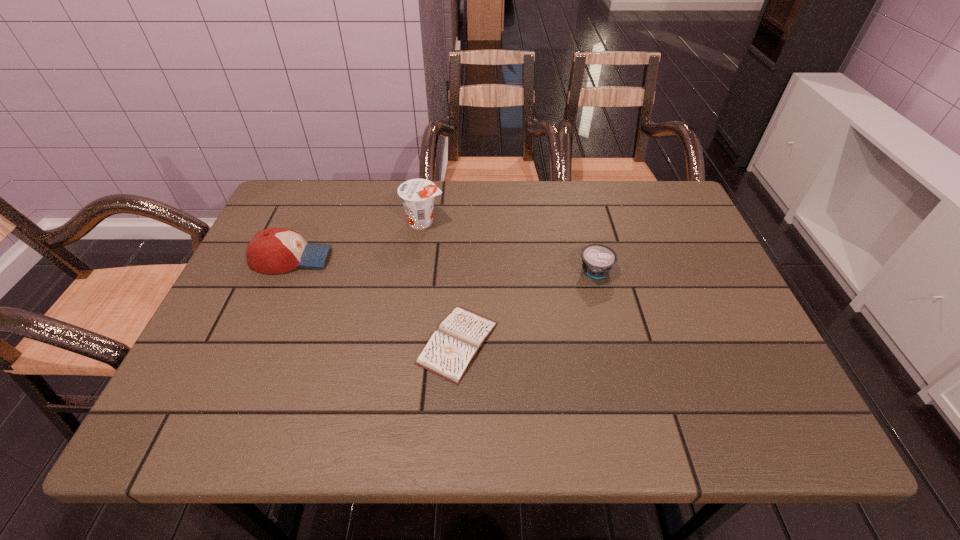
Locate which object is the third closest to the diary. Please provide its 2D coordinates. Your answer should be formatted as a tuple, i.e. [(x, y)], where the tuple contains the x and y coordinates of a point satisfying the conditions above.

[(275, 250)]

Locate an element on the screen. This screenshot has height=540, width=960. vacant space that satisfies the following two spatial constraints: 1. on the front side of the taller yogurt; 2. on the right side of the third tallest object is located at coordinates (417, 272).

Locate an element on the screen. This screenshot has width=960, height=540. free spot that satisfies the following two spatial constraints: 1. on the front-facing side of the third tallest object; 2. on the right side of the third shortest object is located at coordinates pos(286,272).

Find the location of a particular element. This screenshot has height=540, width=960. free space that satisfies the following two spatial constraints: 1. on the back side of the nearer yogurt; 2. on the front-facing side of the leftmost object is located at coordinates (592, 259).

The height and width of the screenshot is (540, 960). What are the coordinates of `free region that satisfies the following two spatial constraints: 1. on the front-facing side of the baseball cap; 2. on the left side of the shorter yogurt` in the screenshot? It's located at (286, 272).

The height and width of the screenshot is (540, 960). I want to click on vacant space that satisfies the following two spatial constraints: 1. on the front-facing side of the second tallest object; 2. on the back side of the rightmost object, so click(286, 272).

I want to click on vacant position in the image that satisfies the following two spatial constraints: 1. on the back side of the right yogurt; 2. on the front-facing side of the baseball cap, so click(592, 259).

Locate an element on the screen. The width and height of the screenshot is (960, 540). free spot that satisfies the following two spatial constraints: 1. on the front-facing side of the baseball cap; 2. on the left side of the nearest object is located at coordinates (255, 343).

Where is `free region that satisfies the following two spatial constraints: 1. on the back side of the diary; 2. on the front-facing side of the third shortest object`? free region that satisfies the following two spatial constraints: 1. on the back side of the diary; 2. on the front-facing side of the third shortest object is located at coordinates (462, 259).

I want to click on vacant position in the image that satisfies the following two spatial constraints: 1. on the front-facing side of the second tallest object; 2. on the left side of the nearest object, so click(x=255, y=343).